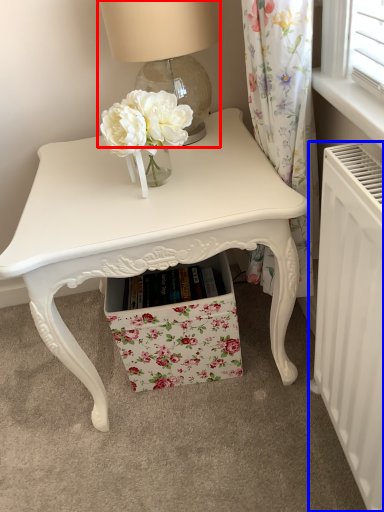
Question: Which point is closer to the camera, table lamp (highlighted by a red box) or radiator (highlighted by a blue box)?

Choices:
 (A) table lamp
 (B) radiator

Answer: (B)